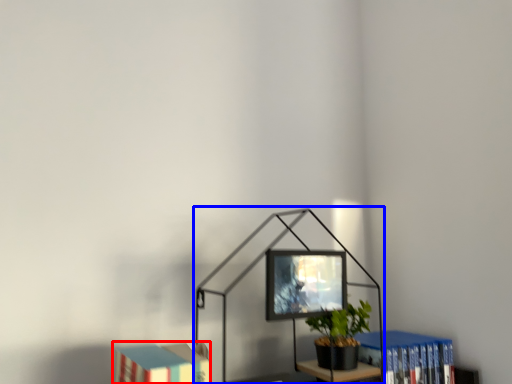
Question: Which object appears closest to the camera in this image, book (highlighted by a red box) or table lamp (highlighted by a blue box)?

Choices:
 (A) book
 (B) table lamp

Answer: (A)